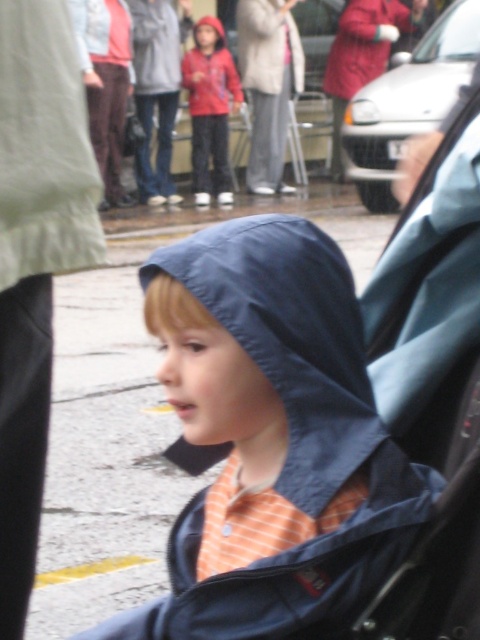
Question: Does matte blue jacket at center have a larger size compared to red matte jacket at center?

Choices:
 (A) no
 (B) yes

Answer: (A)

Question: Does matte blue jacket at center appear on the right side of red matte jacket at center?

Choices:
 (A) no
 (B) yes

Answer: (B)

Question: Is matte blue jacket at center to the left of red matte jacket at center from the viewer's perspective?

Choices:
 (A) yes
 (B) no

Answer: (B)

Question: Which point is farther to the camera?

Choices:
 (A) (199, 161)
 (B) (322, 522)

Answer: (A)